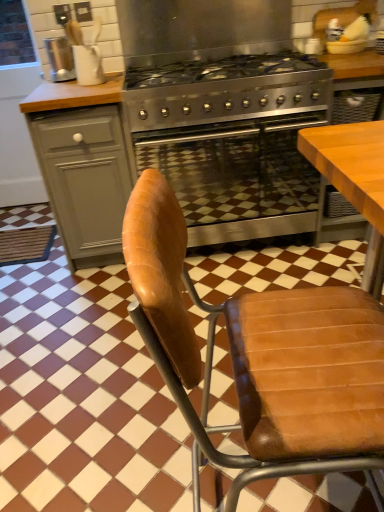
Question: Considering the relative sizes of metallic silver kettle at upper left and matte gray cabinet at left in the image provided, is metallic silver kettle at upper left taller than matte gray cabinet at left?

Choices:
 (A) yes
 (B) no

Answer: (B)

Question: Considering the relative sizes of metallic silver kettle at upper left and matte gray cabinet at left in the image provided, is metallic silver kettle at upper left thinner than matte gray cabinet at left?

Choices:
 (A) no
 (B) yes

Answer: (B)

Question: Is metallic silver kettle at upper left turned away from matte gray cabinet at left?

Choices:
 (A) no
 (B) yes

Answer: (A)

Question: Considering the relative sizes of metallic silver kettle at upper left and matte gray cabinet at left in the image provided, is metallic silver kettle at upper left smaller than matte gray cabinet at left?

Choices:
 (A) no
 (B) yes

Answer: (B)

Question: Can we say metallic silver kettle at upper left lies outside matte gray cabinet at left?

Choices:
 (A) no
 (B) yes

Answer: (B)

Question: From the image's perspective, would you say metallic silver kettle at upper left is shown under matte gray cabinet at left?

Choices:
 (A) yes
 (B) no

Answer: (B)

Question: From the image's perspective, does brown leather chair at center appear lower than stainless steel oven at center?

Choices:
 (A) yes
 (B) no

Answer: (A)

Question: Does brown leather chair at center turn towards stainless steel oven at center?

Choices:
 (A) yes
 (B) no

Answer: (B)

Question: Considering the relative sizes of brown leather chair at center and stainless steel oven at center in the image provided, is brown leather chair at center taller than stainless steel oven at center?

Choices:
 (A) yes
 (B) no

Answer: (A)

Question: Is brown leather chair at center next to stainless steel oven at center and touching it?

Choices:
 (A) no
 (B) yes

Answer: (A)

Question: From a real-world perspective, does brown leather chair at center stand above stainless steel oven at center?

Choices:
 (A) no
 (B) yes

Answer: (B)

Question: Is stainless steel oven at center completely or partially inside brown leather chair at center?

Choices:
 (A) no
 (B) yes

Answer: (A)

Question: Would you say metallic silver kettle at upper left is outside stainless steel gas stove at center?

Choices:
 (A) yes
 (B) no

Answer: (A)